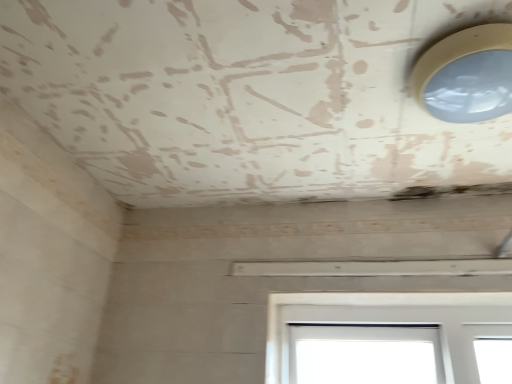
The height and width of the screenshot is (384, 512). I want to click on matte white light fixture at upper right, so click(467, 75).

Describe the element at coordinates (467, 75) in the screenshot. I see `matte white light fixture at upper right` at that location.

What is the approximate height of matte white light fixture at upper right?

matte white light fixture at upper right is 3.37 inches tall.

Identify the location of matte white light fixture at upper right. (467, 75).